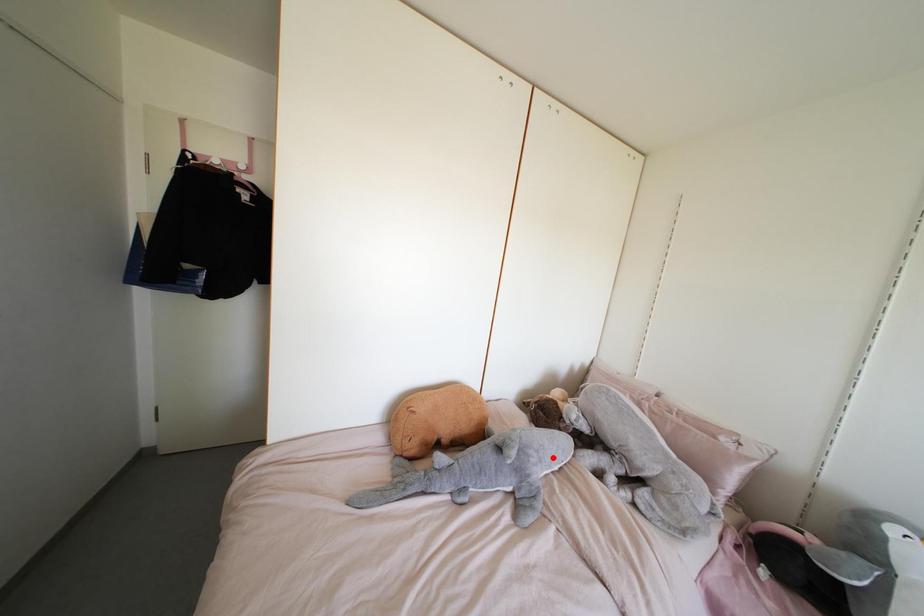
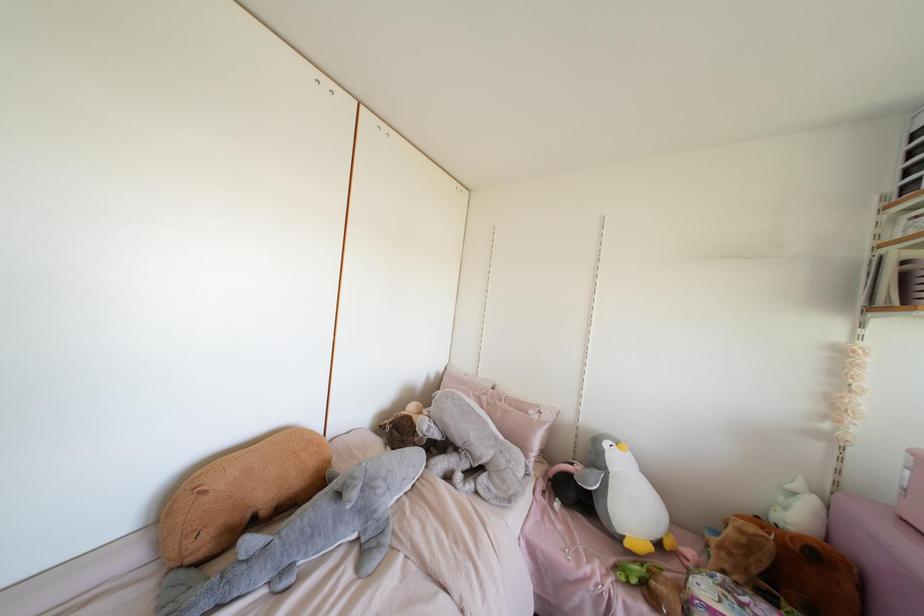
Where in the second image is the point corresponding to the highlighted location from the first image?

(403, 479)